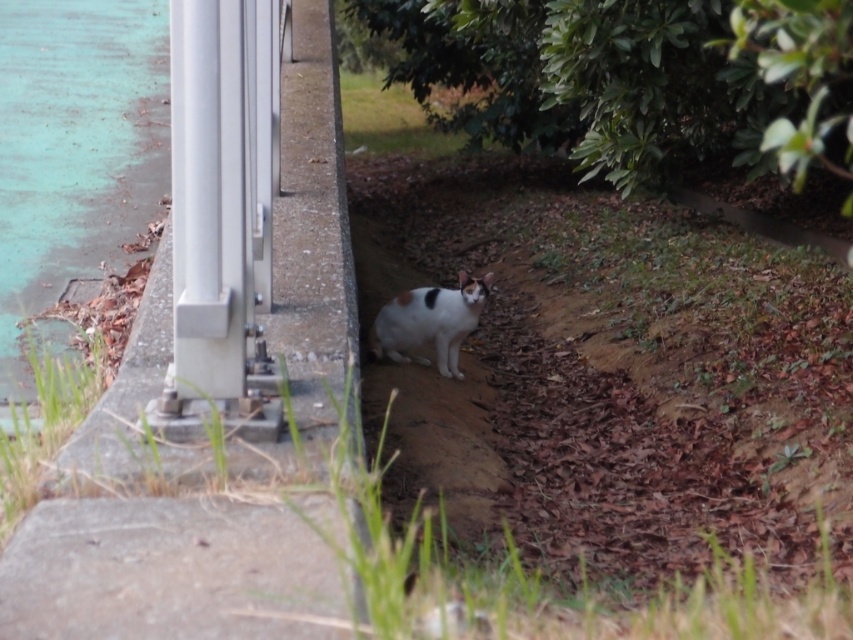
Question: Does brushed metal ledge at lower left have a lesser width compared to silver metallic rail at left?

Choices:
 (A) yes
 (B) no

Answer: (B)

Question: Among these points, which one is farthest from the camera?

Choices:
 (A) (228, 307)
 (B) (415, 348)
 (C) (247, 193)

Answer: (B)

Question: Which of these objects is positioned farthest from the brushed metal ledge at lower left?

Choices:
 (A) white fur cat at center
 (B) silver metallic rail at left

Answer: (A)

Question: Estimate the real-world distances between objects in this image. Which object is farther from the silver metallic rail at left?

Choices:
 (A) brushed metal ledge at lower left
 (B) white fur cat at center

Answer: (B)

Question: Can you confirm if brushed metal ledge at lower left is bigger than silver metallic rail at left?

Choices:
 (A) yes
 (B) no

Answer: (B)

Question: Does brushed metal ledge at lower left have a smaller size compared to white fur cat at center?

Choices:
 (A) no
 (B) yes

Answer: (A)